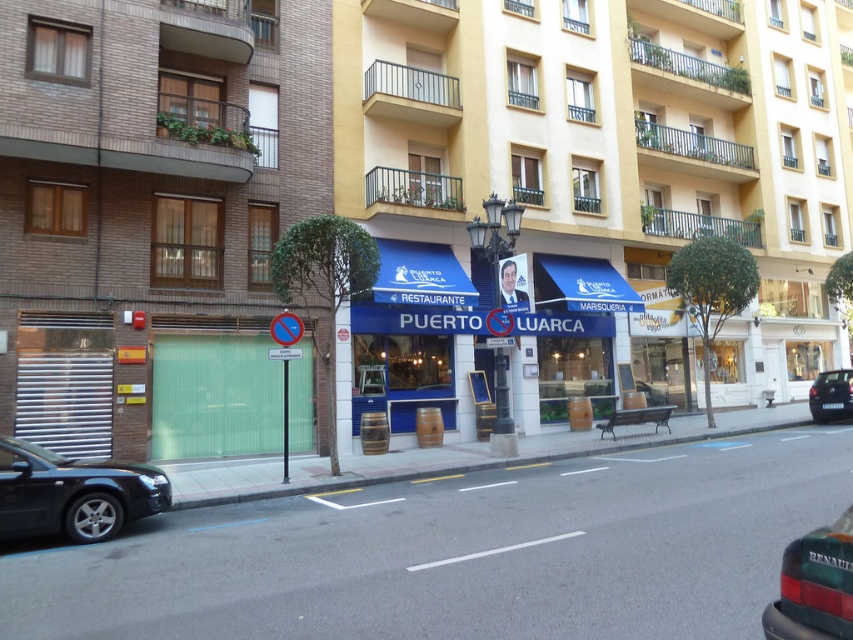
Question: Estimate the real-world distances between objects in this image. Which object is closer to the white plastic license plate at center?

Choices:
 (A) blue painted wooden awning at center
 (B) green corrugated metal at left
 (C) metallic blue sign at center

Answer: (A)

Question: Does shiny black sedan at lower left lie behind white plastic license plate at center?

Choices:
 (A) no
 (B) yes

Answer: (A)

Question: Considering the real-world distances, which object is closest to the metallic blue sign at center?

Choices:
 (A) blue awning restaurant at center
 (B) green corrugated metal at left
 (C) blue painted wooden awning at center
 (D) black metallic car at lower right

Answer: (B)

Question: Observing the image, what is the correct spatial positioning of blue painted wooden awning at center in reference to white plastic license plate at center?

Choices:
 (A) right
 (B) left

Answer: (B)

Question: Does shiny black sedan at lower left have a greater width compared to metallic blue sign at center?

Choices:
 (A) no
 (B) yes

Answer: (B)

Question: Which object is positioned farthest from the shiny black sedan at lower left?

Choices:
 (A) metallic blue sign at center
 (B) green corrugated metal at left
 (C) green matte car at lower right
 (D) black metallic car at lower right

Answer: (D)